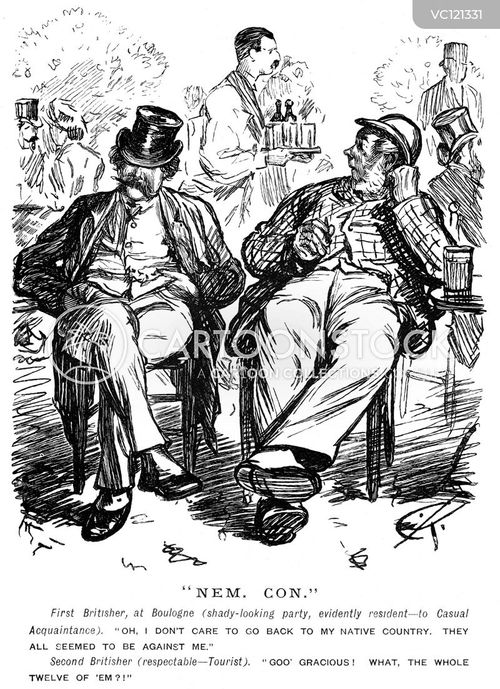
I want to click on chair, so click(x=377, y=404), click(x=177, y=359).